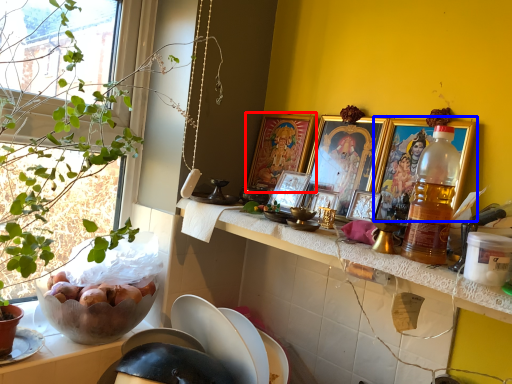
Question: Among these objects, which one is nearest to the camera, picture frame (highlighted by a red box) or picture frame (highlighted by a blue box)?

Choices:
 (A) picture frame
 (B) picture frame

Answer: (B)